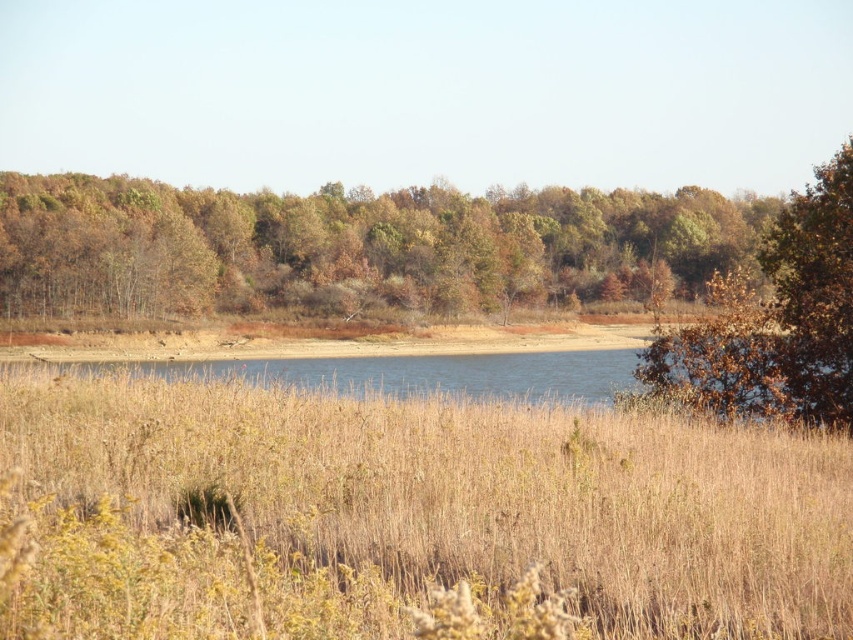
Is dry grass at center shorter than blue water at center?

Indeed, dry grass at center has a lesser height compared to blue water at center.

Is dry grass at center above blue water at center?

Indeed, dry grass at center is positioned over blue water at center.

Between point (303, 454) and point (833, 362), which one is positioned behind?

Positioned behind is point (833, 362).

Where is `dry grass at center`? dry grass at center is located at coordinates [404, 513].

Which is more to the right, brown leafy bush at right or blue water at center?

Positioned to the right is brown leafy bush at right.

Is brown leafy bush at right below blue water at center?

No, brown leafy bush at right is not below blue water at center.

The image size is (853, 640). Describe the element at coordinates (776, 320) in the screenshot. I see `brown leafy bush at right` at that location.

I want to click on brown leafy bush at right, so click(x=776, y=320).

Can you confirm if brown/dry leaves at center is positioned below blue water at center?

No, brown/dry leaves at center is not below blue water at center.

Can you confirm if brown/dry leaves at center is wider than blue water at center?

Indeed, brown/dry leaves at center has a greater width compared to blue water at center.

Does point (102, 241) come farther from viewer compared to point (252, 362)?

That is True.

You are a GUI agent. You are given a task and a screenshot of the screen. Output one action in this format:
    pyautogui.click(x=<x>, y=<y>)
    Task: Click on the brown/dry leaves at center
    The height and width of the screenshot is (640, 853).
    Given the screenshot: What is the action you would take?
    pyautogui.click(x=354, y=248)